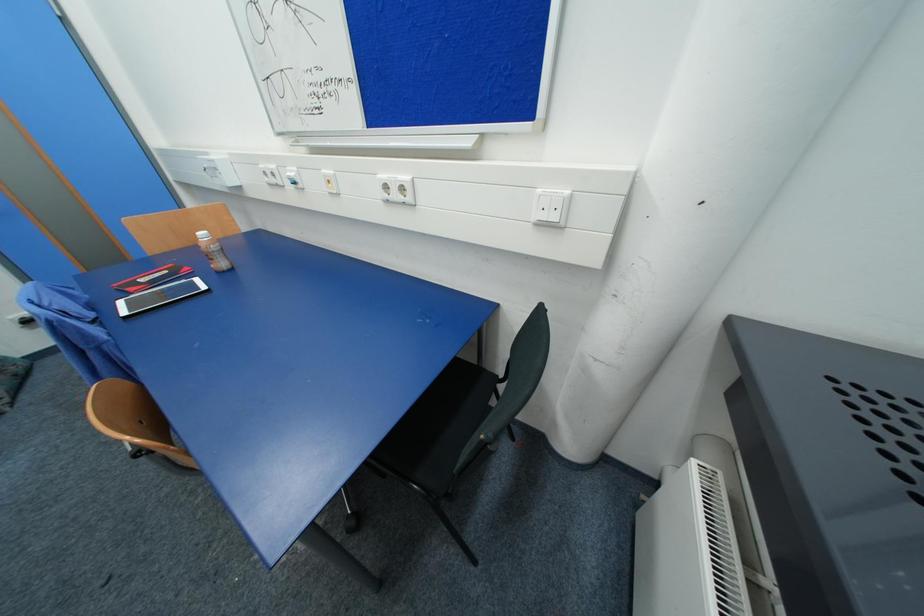
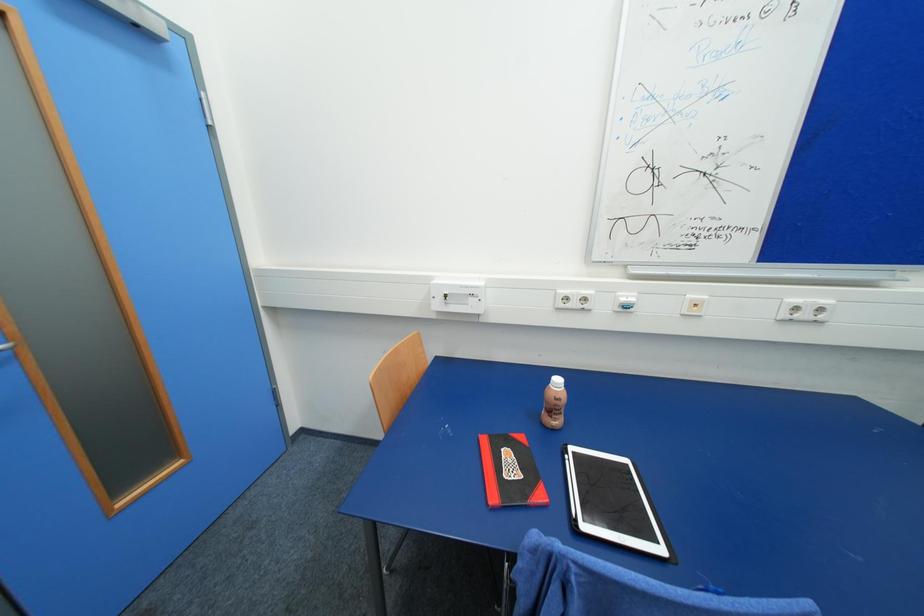
Question: Which direction would the cameraman need to move to produce the second image? Reply with the corresponding letter.

Choices:
 (A) Left
 (B) Right
 (C) Forward
 (D) Backward

Answer: (A)